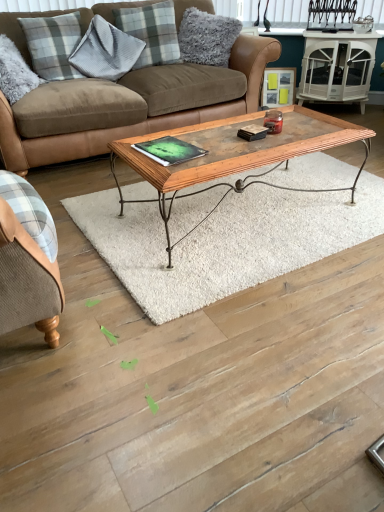
Identify the location of white glossy side table at upper right. (337, 67).

You are a GUI agent. You are given a task and a screenshot of the screen. Output one action in this format:
    pyautogui.click(x=<x>, y=<y>)
    Task: Click on the gray plaid pillow at upper left, which is counted as the third pillow, starting from the left
    
    Given the screenshot: What is the action you would take?
    pyautogui.click(x=151, y=32)

What do you see at coordinates (288, 13) in the screenshot?
I see `clear glass window screen at upper center` at bounding box center [288, 13].

Describe the element at coordinates (129, 106) in the screenshot. I see `brown leather couch at center` at that location.

The image size is (384, 512). Describe the element at coordinates (278, 86) in the screenshot. I see `matte wooden picture frame at upper right` at that location.

Find the location of a particular element. The width and height of the screenshot is (384, 512). wooden table at center is located at coordinates (224, 241).

Considering the points (141, 8) and (277, 104), which point is behind, point (141, 8) or point (277, 104)?

Positioned behind is point (277, 104).

Is gray plaid pillow at upper left, which is counted as the third pillow, starting from the left, next to matte wooden picture frame at upper right?

They are not placed beside each other.

Which object is further away from the camera taking this photo, gray plaid pillow at upper left, which appears as the 2th pillow when viewed from the right, or matte wooden picture frame at upper right?

matte wooden picture frame at upper right is behind.

Which of these two, gray plaid pillow at upper left, which is counted as the third pillow, starting from the left, or matte wooden picture frame at upper right, stands shorter?

Standing shorter between the two is matte wooden picture frame at upper right.

Between plaid fabric pillow at upper left, arranged as the second pillow when viewed from the left, and green matte book at center, which one has smaller width?

plaid fabric pillow at upper left, arranged as the second pillow when viewed from the left.

From the image's perspective, who appears lower, plaid fabric pillow at upper left, which is the 3th pillow in right-to-left order, or green matte book at center?

green matte book at center, from the image's perspective.

Is plaid fabric pillow at upper left, which is the 3th pillow in right-to-left order, behind green matte book at center?

Yes, plaid fabric pillow at upper left, which is the 3th pillow in right-to-left order, is further from the camera.

This screenshot has height=512, width=384. Identify the location of pad that appears below the plaid fabric pillow at upper left, arranged as the second pillow when viewed from the left (from a real-world perspective). (169, 150).

How far apart are wooden table at center and fluffy gray pillow at upper center, marked as the 1th pillow in a right-to-left arrangement?

They are 1.53 meters apart.

Between wooden table at center and fluffy gray pillow at upper center, which appears as the fourth pillow when viewed from the left, which one is positioned behind?

fluffy gray pillow at upper center, which appears as the fourth pillow when viewed from the left, is further away from the camera.

Is wooden table at center taller than fluffy gray pillow at upper center, marked as the 1th pillow in a right-to-left arrangement?

No.

Does point (190, 261) come closer to viewer compared to point (237, 32)?

Yes, point (190, 261) is in front of point (237, 32).

Considering the sizes of objects green matte book at center and brown leather couch at center in the image provided, who is taller, green matte book at center or brown leather couch at center?

With more height is brown leather couch at center.

Is point (176, 147) more distant than point (120, 3)?

That is False.

Considering the relative sizes of green matte book at center and brown leather couch at center in the image provided, is green matte book at center wider than brown leather couch at center?

Incorrect, the width of green matte book at center does not surpass that of brown leather couch at center.

Which is more to the right, wooden glass top coffee table at center or matte wooden picture frame at upper right?

Positioned to the right is matte wooden picture frame at upper right.

Is wooden glass top coffee table at center outside of matte wooden picture frame at upper right?

wooden glass top coffee table at center lies outside matte wooden picture frame at upper right's area.

Is wooden glass top coffee table at center facing away from matte wooden picture frame at upper right?

No, matte wooden picture frame at upper right is not at the back of wooden glass top coffee table at center.

Does point (304, 146) come closer to viewer compared to point (267, 95)?

Yes, point (304, 146) is in front of point (267, 95).

Does point (172, 211) come farther from viewer compared to point (69, 41)?

No, (172, 211) is in front of (69, 41).

What's the angular difference between wooden table at center and gray plaid pillow at upper left, positioned as the first pillow in left-to-right order,'s facing directions?

12.3 degrees.

Between wooden table at center and gray plaid pillow at upper left, the 4th pillow viewed from the right, which one has less height?

Standing shorter between the two is wooden table at center.

From a real-world perspective, who is located higher, wooden table at center or gray plaid pillow at upper left, the 4th pillow viewed from the right?

From a 3D spatial view, gray plaid pillow at upper left, the 4th pillow viewed from the right, is above.

Are clear glass window screen at upper center and wooden glass top coffee table at center making contact?

No, clear glass window screen at upper center is not with wooden glass top coffee table at center.

Is clear glass window screen at upper center situated inside wooden glass top coffee table at center or outside?

clear glass window screen at upper center is not inside wooden glass top coffee table at center, it's outside.

Considering the relative positions of clear glass window screen at upper center and wooden glass top coffee table at center in the image provided, is clear glass window screen at upper center to the left of wooden glass top coffee table at center from the viewer's perspective?

No, clear glass window screen at upper center is not to the left of wooden glass top coffee table at center.

From a real-world perspective, is clear glass window screen at upper center on wooden glass top coffee table at center?

Yes.

The width and height of the screenshot is (384, 512). I want to click on picture frame lying behind the gray plaid pillow at upper left, which appears as the 2th pillow when viewed from the right, so click(278, 86).

At what (x,y) coordinates should I click in order to perform the action: click on the 2nd pillow to the left of the green matte book at center, counting from the anchor's position. Please return your answer as a coordinate pair (x, y). This screenshot has height=512, width=384. Looking at the image, I should click on (105, 51).

Which object lies nearer to the anchor point wooden table at center, brown leather couch at center or fluffy gray pillow at upper center, which appears as the fourth pillow when viewed from the left?

Among the two, brown leather couch at center is located nearer to wooden table at center.

When comparing their distances from green matte book at center, does plaid fabric pillow at upper left, which is the 3th pillow in right-to-left order, or clear glass window screen at upper center seem closer?

plaid fabric pillow at upper left, which is the 3th pillow in right-to-left order, lies closer to green matte book at center than the other object.

Looking at the image, which one is located closer to fluffy gray pillow at upper center, marked as the 1th pillow in a right-to-left arrangement, plaid fabric pillow at upper left, which is the 3th pillow in right-to-left order, or green matte book at center?

The object closer to fluffy gray pillow at upper center, marked as the 1th pillow in a right-to-left arrangement, is plaid fabric pillow at upper left, which is the 3th pillow in right-to-left order.

Considering their positions, is gray plaid pillow at upper left, the 4th pillow viewed from the right, positioned further to gray plaid pillow at upper left, which is counted as the third pillow, starting from the left, than brown leather couch at center?

Among the two, gray plaid pillow at upper left, the 4th pillow viewed from the right, is located further to gray plaid pillow at upper left, which is counted as the third pillow, starting from the left.

Estimate the real-world distances between objects in this image. Which object is closer to white glossy side table at upper right, gray plaid pillow at upper left, positioned as the first pillow in left-to-right order, or wooden glass top coffee table at center?

wooden glass top coffee table at center lies closer to white glossy side table at upper right than the other object.

From the image, which object appears to be farther from plaid fabric pillow at upper left, which is the 3th pillow in right-to-left order, wooden table at center or clear glass window screen at upper center?

clear glass window screen at upper center is positioned further to the anchor plaid fabric pillow at upper left, which is the 3th pillow in right-to-left order.

Based on their spatial positions, is wooden table at center or brown leather couch at center closer to clear glass window screen at upper center?

Among the two, brown leather couch at center is located nearer to clear glass window screen at upper center.

Which object lies nearer to the anchor point gray plaid pillow at upper left, which appears as the 2th pillow when viewed from the right, clear glass window screen at upper center or brown leather couch at center?

Among the two, brown leather couch at center is located nearer to gray plaid pillow at upper left, which appears as the 2th pillow when viewed from the right.

This screenshot has width=384, height=512. Identify the location of picture frame located between brown leather couch at center and white glossy side table at upper right in the left-right direction. (278, 86).

Where is `studio couch between gray plaid pillow at upper left, positioned as the first pillow in left-to-right order, and wooden table at center vertically`? Image resolution: width=384 pixels, height=512 pixels. studio couch between gray plaid pillow at upper left, positioned as the first pillow in left-to-right order, and wooden table at center vertically is located at coordinates (129, 106).

What are the coordinates of `pad between gray plaid pillow at upper left, which appears as the 2th pillow when viewed from the right, and wooden glass top coffee table at center from top to bottom` in the screenshot? It's located at (169, 150).

You are a GUI agent. You are given a task and a screenshot of the screen. Output one action in this format:
    pyautogui.click(x=<x>, y=<y>)
    Task: Click on the mat between plaid fabric pillow at upper left, which is the 3th pillow in right-to-left order, and white glossy side table at upper right
    Image resolution: width=384 pixels, height=512 pixels.
    Given the screenshot: What is the action you would take?
    pyautogui.click(x=224, y=241)